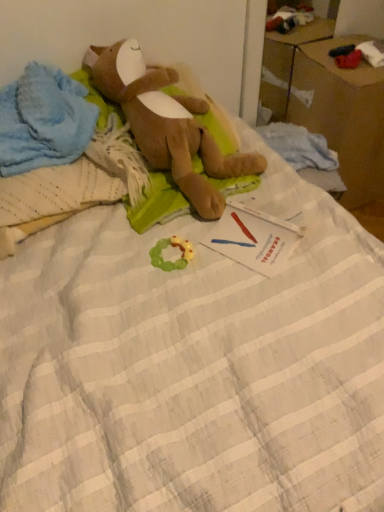
Question: From a real-world perspective, is green rubber teething ring at center, which appears as the 1th toy when viewed from the back, beneath brown plush toy at upper left, which is the second toy from back to front?

Choices:
 (A) yes
 (B) no

Answer: (A)

Question: From the image's perspective, would you say green rubber teething ring at center, the 2th toy positioned from the front, is shown under brown plush toy at upper left, the first toy viewed from the front?

Choices:
 (A) no
 (B) yes

Answer: (B)

Question: Could you tell me if green rubber teething ring at center, the 2th toy when ordered from top to bottom, is facing brown plush toy at upper left, the second toy positioned from the bottom?

Choices:
 (A) yes
 (B) no

Answer: (B)

Question: Is green rubber teething ring at center, which appears as the 1th toy when viewed from the back, positioned behind brown plush toy at upper left, which is the first toy from top to bottom?

Choices:
 (A) no
 (B) yes

Answer: (B)

Question: Can you confirm if green rubber teething ring at center, which appears as the 1th toy when viewed from the back, is smaller than brown plush toy at upper left, which is the second toy from back to front?

Choices:
 (A) no
 (B) yes

Answer: (B)

Question: Are green rubber teething ring at center, the 2th toy positioned from the front, and brown plush toy at upper left, which is the first toy from top to bottom, located far from each other?

Choices:
 (A) yes
 (B) no

Answer: (B)

Question: Is white paper at center located within brown plush toy at upper left, which is the first toy from top to bottom?

Choices:
 (A) no
 (B) yes

Answer: (A)

Question: From the image's perspective, is brown plush toy at upper left, the first toy viewed from the front, located beneath white paper at center?

Choices:
 (A) no
 (B) yes

Answer: (A)

Question: Is brown plush toy at upper left, which is the second toy from back to front, at the right side of white paper at center?

Choices:
 (A) no
 (B) yes

Answer: (A)

Question: From a real-world perspective, is brown plush toy at upper left, the first toy viewed from the front, beneath white paper at center?

Choices:
 (A) no
 (B) yes

Answer: (A)

Question: Is there a large distance between brown plush toy at upper left, the first toy viewed from the front, and white paper at center?

Choices:
 (A) yes
 (B) no

Answer: (B)

Question: Can we say brown plush toy at upper left, which is the second toy from back to front, lies outside white paper at center?

Choices:
 (A) yes
 (B) no

Answer: (A)

Question: From a real-world perspective, is brown cardboard box at upper right positioned under brown plush toy at upper left, the second toy positioned from the bottom, based on gravity?

Choices:
 (A) yes
 (B) no

Answer: (A)